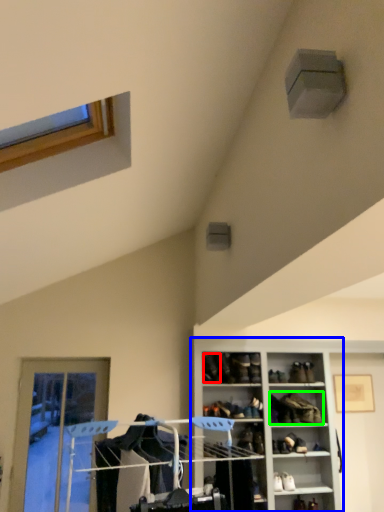
Question: Estimate the real-world distances between objects in this image. Which object is closer to shoe (highlighted by a red box), cabinetry (highlighted by a blue box) or footwear (highlighted by a green box)?

Choices:
 (A) cabinetry
 (B) footwear

Answer: (A)